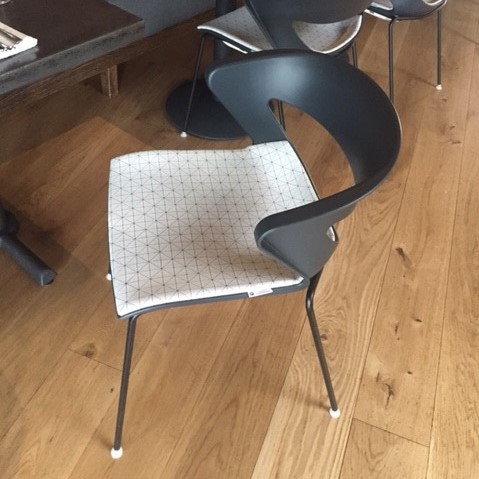
At what (x,y) coordinates should I click in order to perform the action: click on chair backs. Please return your answer as a coordinate pair (x, y). This screenshot has height=479, width=479. Looking at the image, I should click on (362, 108), (333, 10).